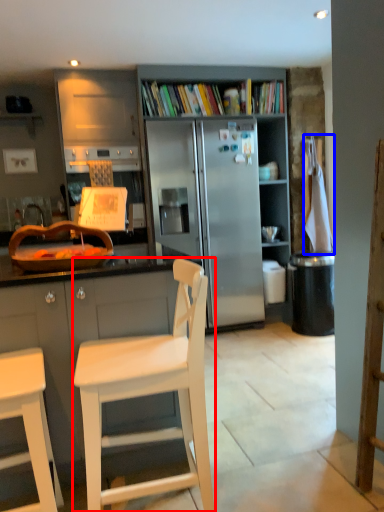
Question: Among these objects, which one is nearest to the camera, chair (highlighted by a red box) or towel/napkin (highlighted by a blue box)?

Choices:
 (A) chair
 (B) towel/napkin

Answer: (A)